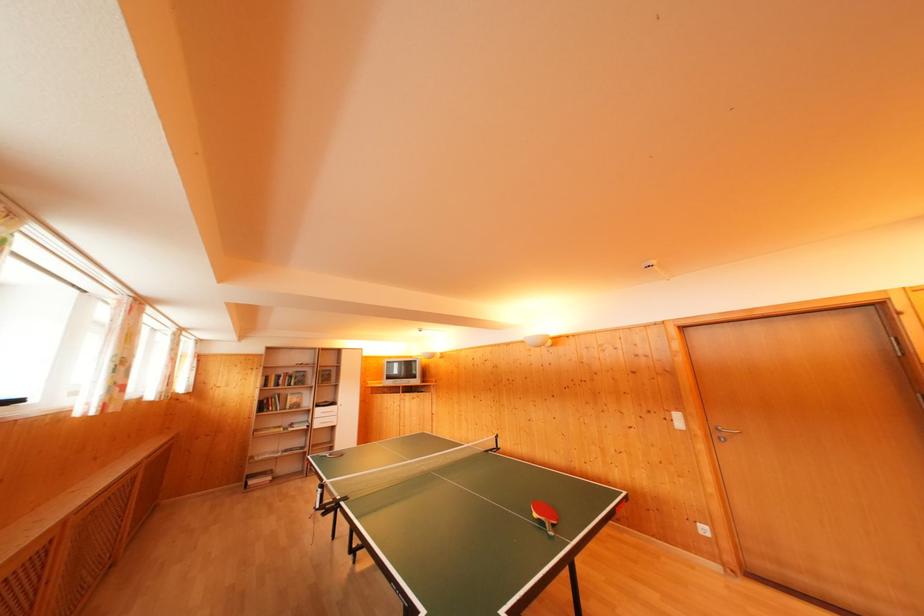
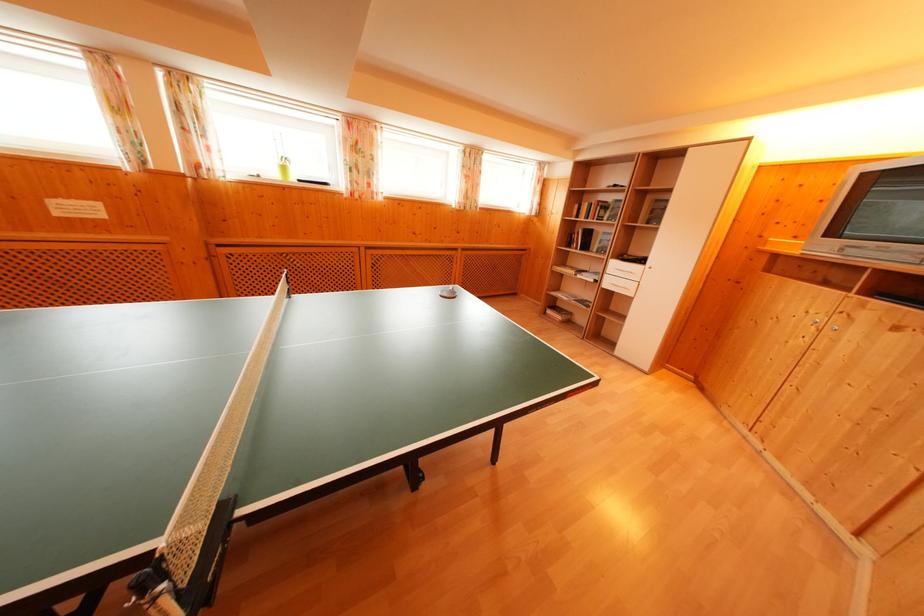
In the second image, find the point that corresponds to (x=321, y=421) in the first image.

(614, 276)